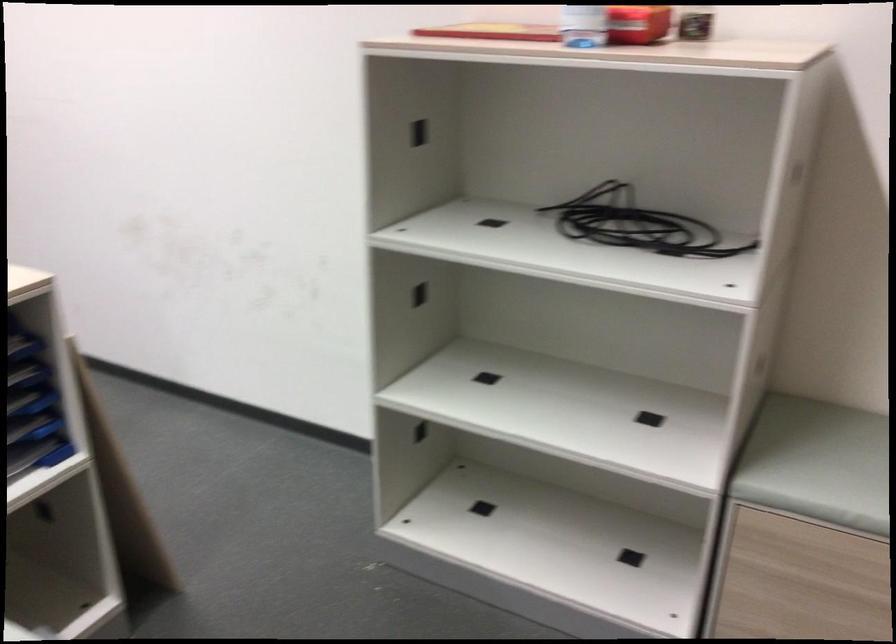
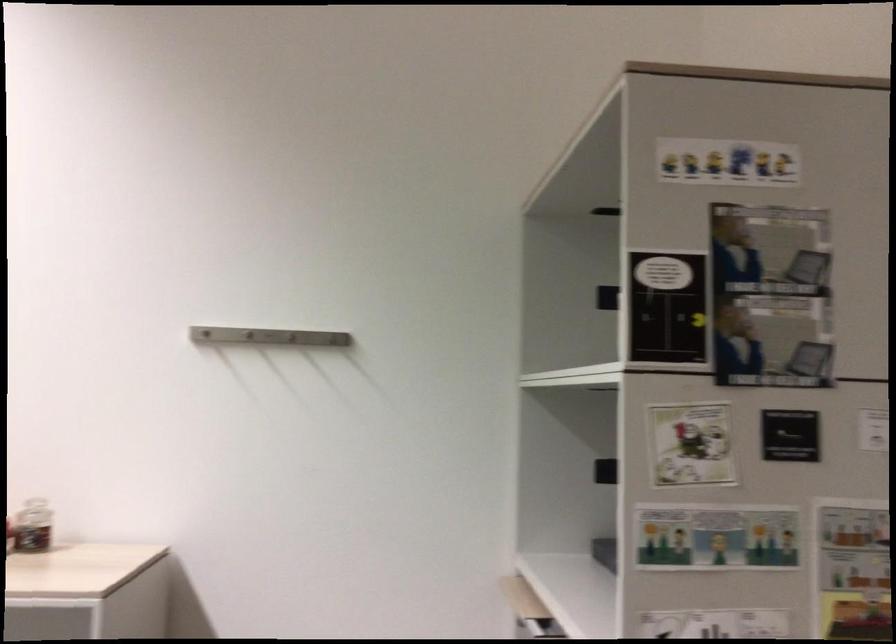
The first image is from the beginning of the video and the second image is from the end. How did the camera likely rotate when shooting the video?

The rotation direction of the camera is right-up.